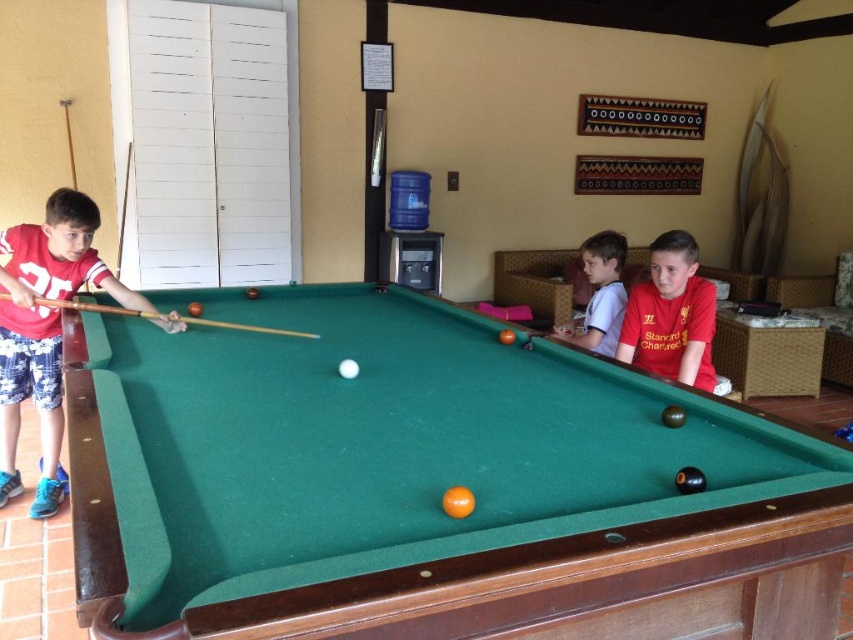
You are a person standing at the center of the pool table. You want to grab the wooden cue at left and the white cotton shirt at upper right. Which object is closer to you?

The wooden cue at left is closer to you because it is positioned to the left of the pool table, while the white cotton shirt at upper right is further away from you as it is located at the upper right side of the scene.

You are standing in the recreational room and want to play pool. Where is the green felt pool table at center located?

The green felt pool table at center is located at point (431, 483).

You are a visitor in the room and want to know if the green felt pool table at center is tall enough to block the view of the matte red shirt at left from someone standing behind it. Can you confirm?

The green felt pool table at center is shorter than the matte red shirt at left, so it cannot block the view of the matte red shirt at left from someone standing behind it.